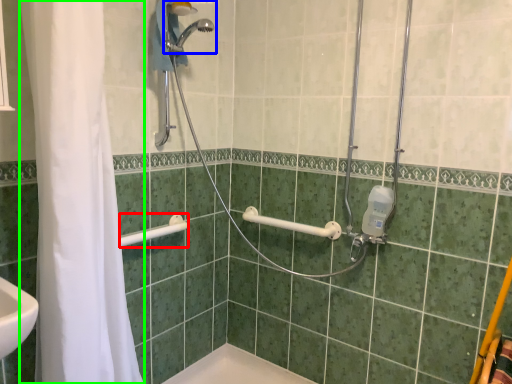
Question: Based on their relative distances, which object is nearer to shower (highlighted by a red box)? Choose from shower (highlighted by a blue box) and shower curtain (highlighted by a green box).

Choices:
 (A) shower
 (B) shower curtain

Answer: (B)